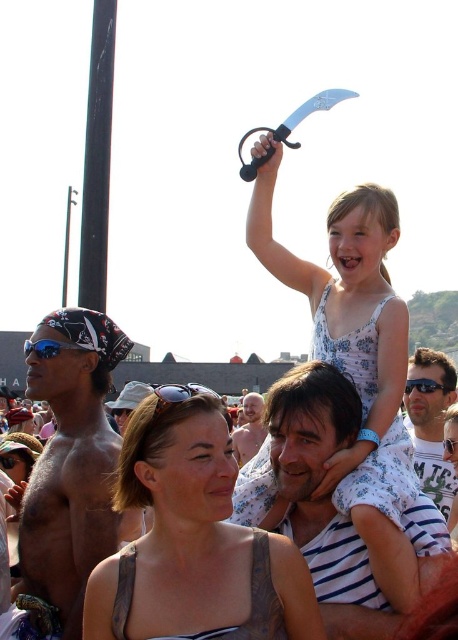
You are a photographer trying to capture a clear shot of the matte white shirt at center and the black plastic sunglasses at upper center. Since you want to focus on both objects equally, which one should you adjust your camera settings to prioritize in terms of size to ensure they appear balanced in the photo?

The matte white shirt at center is wider than the black plastic sunglasses at upper center. To balance their sizes in the photo, you should adjust the camera settings to make the matte white shirt at center appear smaller or move closer to the black plastic sunglasses at upper center so both objects appear similar in size.

You are a photographer trying to capture a clear shot of the bald head at center and the shiny metallic bandana at left. Based on their sizes in the image, which object would appear larger in your photo?

The shiny metallic bandana at left might appear wider than bald head at center, so it would likely be larger in the photo.

Consider the image. You are a photographer trying to capture the bald head at center and the black plastic sunglasses at upper center in a single frame. Based on their positions, which object should you focus on first to ensure both are in the frame?

The bald head at center should be focused on first because it is below the black plastic sunglasses at upper center, so adjusting the frame to include the lower object first ensures the upper one is also captured.